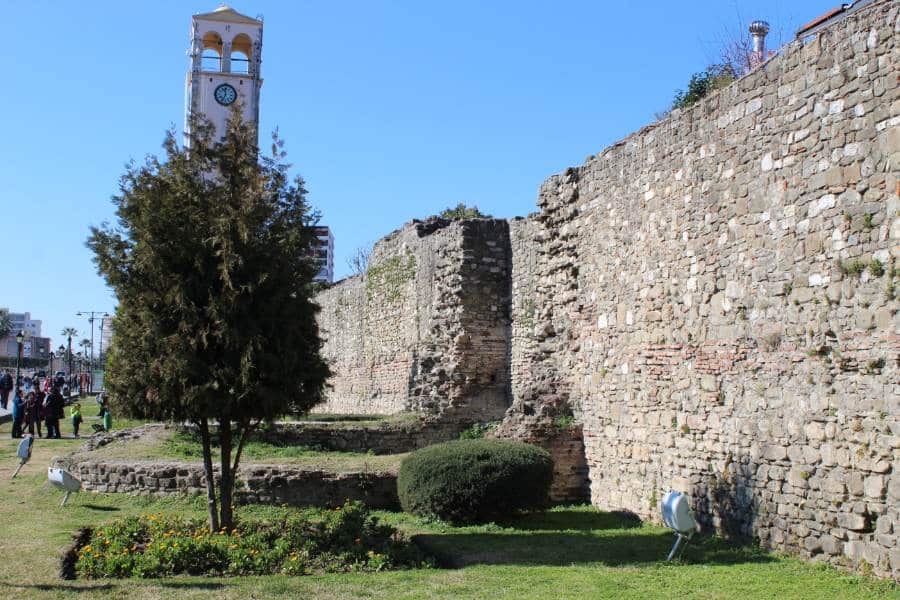
Locate an element on the screen. This screenshot has height=600, width=900. corner is located at coordinates (461, 362).